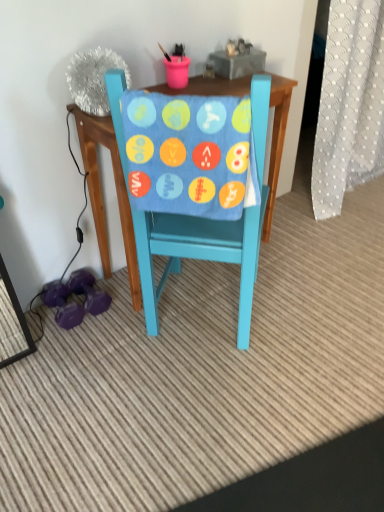
You are a GUI agent. You are given a task and a screenshot of the screen. Output one action in this format:
    pyautogui.click(x=<x>, y=<y>)
    Task: Click on the teal painted wood chair at center
    The height and width of the screenshot is (512, 384).
    Given the screenshot: What is the action you would take?
    pyautogui.click(x=197, y=255)

Identify the location of white dotted fabric at right. Image resolution: width=384 pixels, height=512 pixels. (349, 104).

Where is `teal painted wood chair at center`? The width and height of the screenshot is (384, 512). teal painted wood chair at center is located at coordinates (197, 255).

Is blue soft fabric at center beside teal painted wood chair at center?

No.

Considering the relative positions of blue soft fabric at center and teal painted wood chair at center in the image provided, is blue soft fabric at center to the left or to the right of teal painted wood chair at center?

In the image, blue soft fabric at center appears on the left side of teal painted wood chair at center.

Is blue soft fabric at center wider or thinner than teal painted wood chair at center?

In the image, blue soft fabric at center appears to be more narrow than teal painted wood chair at center.

Considering the positions of point (146, 194) and point (205, 237), is point (146, 194) closer or farther from the camera than point (205, 237)?

Point (146, 194) is closer to the camera than point (205, 237).

From the image's perspective, which one is positioned higher, teal painted wood chair at center or white dotted fabric at right?

white dotted fabric at right, from the image's perspective.

Which of these two, teal painted wood chair at center or white dotted fabric at right, is smaller?

With smaller size is teal painted wood chair at center.

Is teal painted wood chair at center not within white dotted fabric at right?

Yes, teal painted wood chair at center is not within white dotted fabric at right.

Locate an element on the screen. The width and height of the screenshot is (384, 512). curtain behind the teal painted wood chair at center is located at coordinates (349, 104).

Is white dotted fabric at right not close to teal painted wood chair at center?

That's right, there is a large distance between white dotted fabric at right and teal painted wood chair at center.

Is white dotted fabric at right outside of teal painted wood chair at center?

Yes, white dotted fabric at right is located beyond the bounds of teal painted wood chair at center.

Is white dotted fabric at right bigger than teal painted wood chair at center?

Yes.

Considering the relative sizes of blue soft fabric at center and white dotted fabric at right in the image provided, is blue soft fabric at center taller than white dotted fabric at right?

Incorrect, the height of blue soft fabric at center is not larger of that of white dotted fabric at right.

What's the angular difference between blue soft fabric at center and white dotted fabric at right's facing directions?

The angle between the facing direction of blue soft fabric at center and the facing direction of white dotted fabric at right is 131 degrees.

From a real-world perspective, is blue soft fabric at center positioned over white dotted fabric at right based on gravity?

Correct, in the physical world, blue soft fabric at center is higher than white dotted fabric at right.

Which of these two, blue soft fabric at center or white dotted fabric at right, is thinner?

blue soft fabric at center is thinner.

Considering the sizes of white dotted fabric at right and blue soft fabric at center in the image, is white dotted fabric at right wider or thinner than blue soft fabric at center?

white dotted fabric at right is wider than blue soft fabric at center.

Is white dotted fabric at right far away from blue soft fabric at center?

Yes, white dotted fabric at right and blue soft fabric at center are located far from each other.

Which of these two, white dotted fabric at right or blue soft fabric at center, stands shorter?

Standing shorter between the two is blue soft fabric at center.

Is white dotted fabric at right at the right side of blue soft fabric at center?

Indeed, white dotted fabric at right is positioned on the right side of blue soft fabric at center.

Which of these two, teal painted wood chair at center or blue soft fabric at center, is smaller?

With smaller size is blue soft fabric at center.

Is teal painted wood chair at center touching blue soft fabric at center?

No, teal painted wood chair at center is not beside blue soft fabric at center.

In order to click on chair below the blue soft fabric at center (from a real-world perspective) in this screenshot , I will do `click(197, 255)`.

Based on the photo, from a real-world perspective, is teal painted wood chair at center physically located above or below blue soft fabric at center?

In terms of real-world spatial position, teal painted wood chair at center is below blue soft fabric at center.

At what (x,y) coordinates should I click in order to perform the action: click on blanket above the teal painted wood chair at center (from the image's perspective). Please return your answer as a coordinate pair (x, y). The width and height of the screenshot is (384, 512). Looking at the image, I should click on (x=190, y=154).

Where is `curtain above the teal painted wood chair at center (from a real-world perspective)`? The width and height of the screenshot is (384, 512). curtain above the teal painted wood chair at center (from a real-world perspective) is located at coordinates (349, 104).

Which object lies nearer to the anchor point white dotted fabric at right, teal painted wood chair at center or blue soft fabric at center?

Among the two, teal painted wood chair at center is located nearer to white dotted fabric at right.

When comparing their distances from teal painted wood chair at center, does blue soft fabric at center or white dotted fabric at right seem closer?

blue soft fabric at center is positioned closer to the anchor teal painted wood chair at center.

Which object lies nearer to the anchor point white dotted fabric at right, blue soft fabric at center or teal painted wood chair at center?

The object closer to white dotted fabric at right is teal painted wood chair at center.

Based on their spatial positions, is white dotted fabric at right or blue soft fabric at center further from teal painted wood chair at center?

white dotted fabric at right is further to teal painted wood chair at center.

In the scene shown: Which object lies further to the anchor point blue soft fabric at center, teal painted wood chair at center or white dotted fabric at right?

white dotted fabric at right.

Estimate the real-world distances between objects in this image. Which object is further from blue soft fabric at center, white dotted fabric at right or teal painted wood chair at center?

Among the two, white dotted fabric at right is located further to blue soft fabric at center.

Locate an element on the screen. The width and height of the screenshot is (384, 512). chair between blue soft fabric at center and white dotted fabric at right in the horizontal direction is located at coordinates (197, 255).